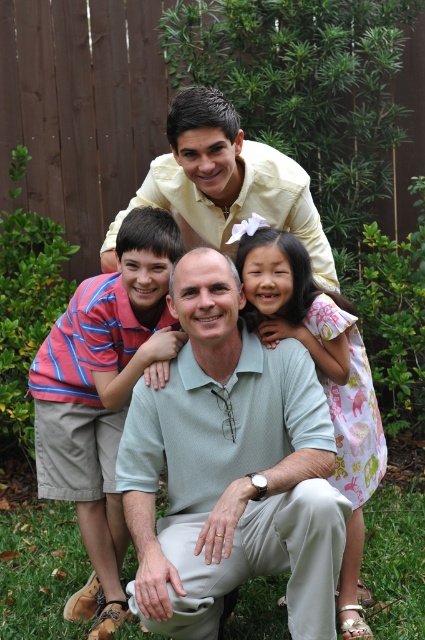
Question: Which object appears farthest from the camera in this image?

Choices:
 (A) green grass at lower center
 (B) striped cotton shirt at left

Answer: (A)

Question: Which object is positioned farthest from the striped cotton shirt at left?

Choices:
 (A) matte yellow shirt at upper center
 (B) light green textured shirt at center
 (C) green grass at lower center

Answer: (C)

Question: Is light green textured shirt at center smaller than matte yellow shirt at upper center?

Choices:
 (A) no
 (B) yes

Answer: (B)

Question: Considering the real-world distances, which object is closest to the pink floral dress at upper center?

Choices:
 (A) matte yellow shirt at upper center
 (B) green grass at lower center

Answer: (A)

Question: Is pink floral dress at upper center wider than matte yellow shirt at upper center?

Choices:
 (A) no
 (B) yes

Answer: (A)

Question: Where is pink floral dress at upper center located in relation to matte yellow shirt at upper center in the image?

Choices:
 (A) below
 (B) above

Answer: (A)